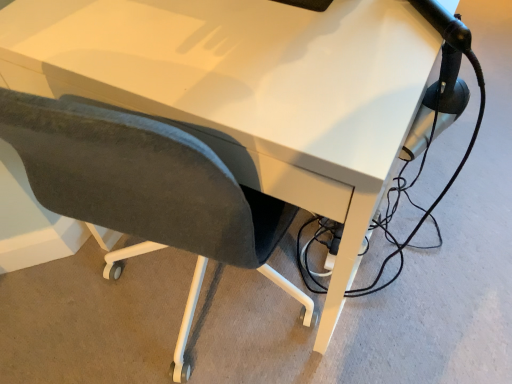
Describe the element at coordinates (146, 191) in the screenshot. I see `dark gray fabric chair at lower left` at that location.

The height and width of the screenshot is (384, 512). What are the coordinates of `dark gray fabric chair at lower left` in the screenshot? It's located at (146, 191).

Find the location of `dark gray fabric chair at lower left`. dark gray fabric chair at lower left is located at coordinates (146, 191).